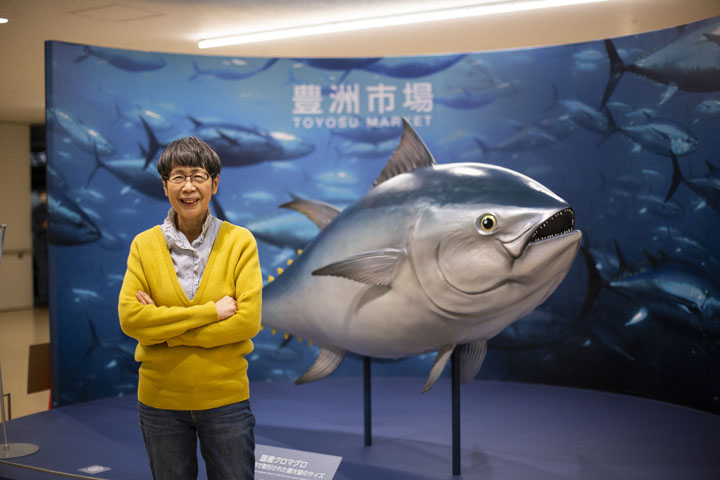
Locate an element on the screen. The image size is (720, 480). area rug is located at coordinates (37, 360).